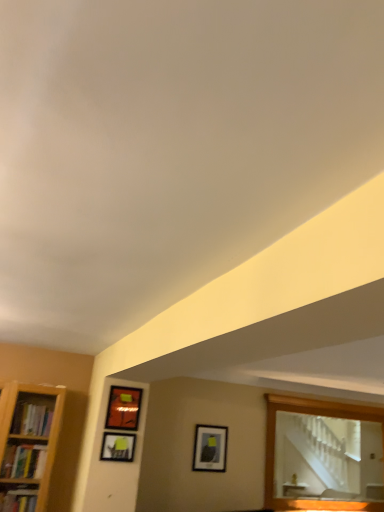
Question: Which direction should I rotate to look at matte black picture frame at center, which is the 3th picture frame from left to right, — up or down?

Choices:
 (A) down
 (B) up

Answer: (A)

Question: Could you tell me if wooden mirror at upper right is facing matte black picture frame at upper center, which ranks as the first picture frame in left-to-right order?

Choices:
 (A) yes
 (B) no

Answer: (B)

Question: From a real-world perspective, does wooden mirror at upper right stand above matte black picture frame at upper center, positioned as the second picture frame in bottom-to-top order?

Choices:
 (A) no
 (B) yes

Answer: (B)

Question: Is wooden mirror at upper right positioned before matte black picture frame at upper center, positioned as the second picture frame in top-to-bottom order?

Choices:
 (A) no
 (B) yes

Answer: (A)

Question: Are wooden mirror at upper right and matte black picture frame at upper center, which is the 3th picture frame in right-to-left order, located far from each other?

Choices:
 (A) yes
 (B) no

Answer: (A)

Question: From a real-world perspective, is wooden mirror at upper right physically below matte black picture frame at upper center, which appears as the third picture frame when viewed from the back?

Choices:
 (A) no
 (B) yes

Answer: (A)

Question: Can you confirm if wooden mirror at upper right is positioned to the right of matte black picture frame at upper center, the 1th picture frame positioned from the front?

Choices:
 (A) no
 (B) yes

Answer: (B)

Question: Considering the relative sizes of matte black picture frame at center, which is counted as the first picture frame, starting from the bottom, and matte black picture frame at upper center, which is the 3th picture frame in right-to-left order, in the image provided, is matte black picture frame at center, which is counted as the first picture frame, starting from the bottom, taller than matte black picture frame at upper center, which is the 3th picture frame in right-to-left order,?

Choices:
 (A) no
 (B) yes

Answer: (B)

Question: Does matte black picture frame at center, which is the 3th picture frame from left to right, have a smaller size compared to matte black picture frame at upper center, which appears as the third picture frame when viewed from the back?

Choices:
 (A) no
 (B) yes

Answer: (A)

Question: From a real-world perspective, is matte black picture frame at center, acting as the third picture frame starting from the front, on matte black picture frame at upper center, which ranks as the first picture frame in left-to-right order?

Choices:
 (A) yes
 (B) no

Answer: (A)

Question: Is matte black picture frame at center, which ranks as the first picture frame in back-to-front order, in front of matte black picture frame at upper center, which appears as the third picture frame when viewed from the back?

Choices:
 (A) yes
 (B) no

Answer: (B)

Question: Are matte black picture frame at center, the 3th picture frame viewed from the top, and matte black picture frame at upper center, the 1th picture frame positioned from the front, far apart?

Choices:
 (A) no
 (B) yes

Answer: (B)

Question: Considering the relative positions of matte black picture frame at center, which is counted as the first picture frame, starting from the bottom, and matte black picture frame at upper center, which ranks as the first picture frame in left-to-right order, in the image provided, is matte black picture frame at center, which is counted as the first picture frame, starting from the bottom, to the left of matte black picture frame at upper center, which ranks as the first picture frame in left-to-right order, from the viewer's perspective?

Choices:
 (A) yes
 (B) no

Answer: (B)

Question: Can you confirm if matte black picture frame at upper center, which is the 3th picture frame in right-to-left order, is wider than matte orange picture frame at upper left, the second picture frame viewed from the left?

Choices:
 (A) no
 (B) yes

Answer: (A)